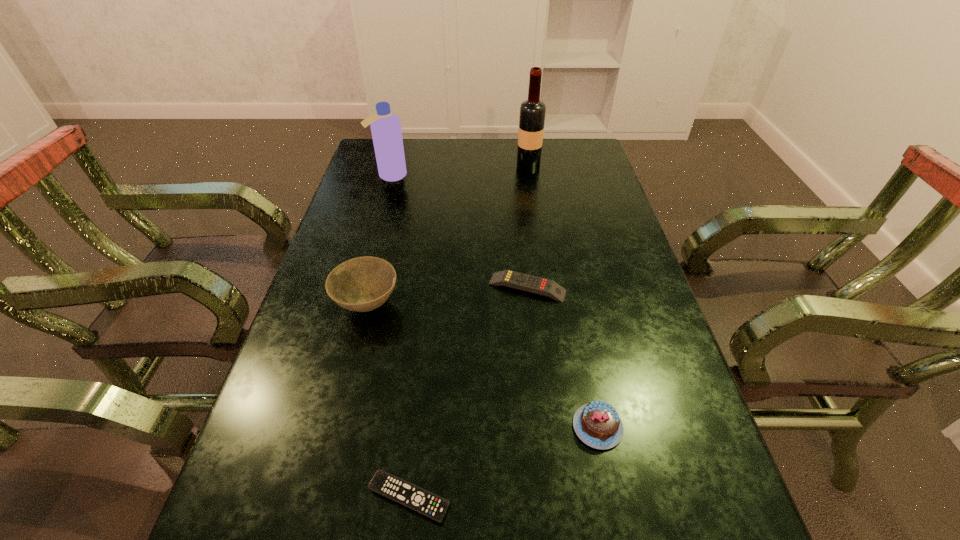
This screenshot has width=960, height=540. Identify the location of object present at the far left corner. (385, 126).

The width and height of the screenshot is (960, 540). What are the coordinates of `free space at the far edge of the desktop` in the screenshot? It's located at (471, 148).

This screenshot has height=540, width=960. In order to click on blank area at the left edge in this screenshot , I will do `click(336, 354)`.

Locate an element on the screen. The image size is (960, 540). blank space at the right edge of the desktop is located at coordinates (658, 350).

Locate an element on the screen. free space at the far left corner of the desktop is located at coordinates (371, 155).

Find the location of `vacant area that lies between the bowl and the fourth tallest object`. vacant area that lies between the bowl and the fourth tallest object is located at coordinates (483, 366).

Find the location of a particular element. The width and height of the screenshot is (960, 540). empty space between the second tallest object and the wine bottle is located at coordinates (459, 172).

What are the coordinates of `vacant area between the third tallest object and the tallest object` in the screenshot? It's located at (447, 236).

This screenshot has height=540, width=960. I want to click on empty space that is in between the third shortest object and the second shortest object, so click(563, 357).

I want to click on free space between the second tallest object and the fourth object from right to left, so click(399, 336).